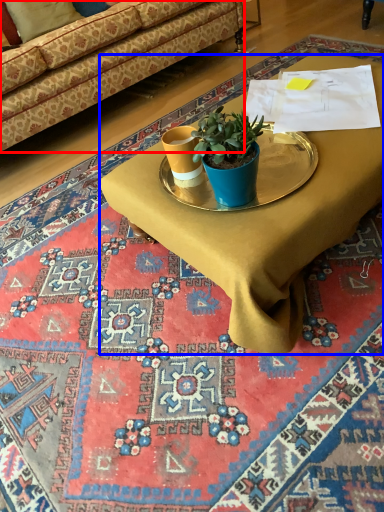
Question: Which of the following is the farthest to the observer, studio couch (highlighted by a red box) or desk (highlighted by a blue box)?

Choices:
 (A) studio couch
 (B) desk

Answer: (A)